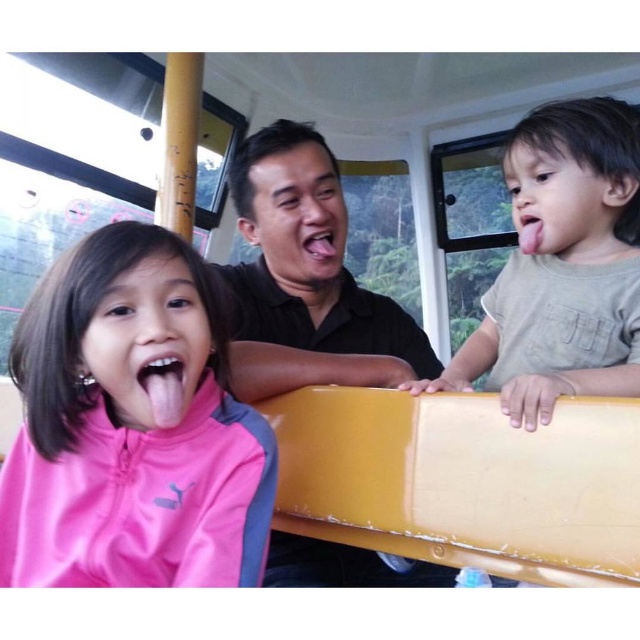
Can you confirm if light brown cotton shirt at right is bigger than pink matte tongue at center?

Correct, light brown cotton shirt at right is larger in size than pink matte tongue at center.

Is point (570, 220) positioned before point (330, 256)?

Yes, point (570, 220) is in front of point (330, 256).

The width and height of the screenshot is (640, 640). Find the location of `light brown cotton shirt at right`. light brown cotton shirt at right is located at coordinates (563, 266).

Between light brown cotton shirt at right and pink matte tongue at right, which one has less height?

Standing shorter between the two is pink matte tongue at right.

Is light brown cotton shirt at right to the left of pink matte tongue at right from the viewer's perspective?

In fact, light brown cotton shirt at right is to the right of pink matte tongue at right.

Is point (589, 368) closer to camera compared to point (536, 252)?

Yes, it is.

Identify the location of light brown cotton shirt at right. (563, 266).

Can you confirm if pink fabric jacket at left is thinner than pink matte tongue at right?

In fact, pink fabric jacket at left might be wider than pink matte tongue at right.

Does pink fabric jacket at left have a lesser height compared to pink matte tongue at right?

In fact, pink fabric jacket at left may be taller than pink matte tongue at right.

Measure the distance between pink fabric jacket at left and camera.

26.07 inches

You are a GUI agent. You are given a task and a screenshot of the screen. Output one action in this format:
    pyautogui.click(x=<x>, y=<y>)
    Task: Click on the pink fabric jacket at left
    This screenshot has height=640, width=640.
    Given the screenshot: What is the action you would take?
    pyautogui.click(x=131, y=429)